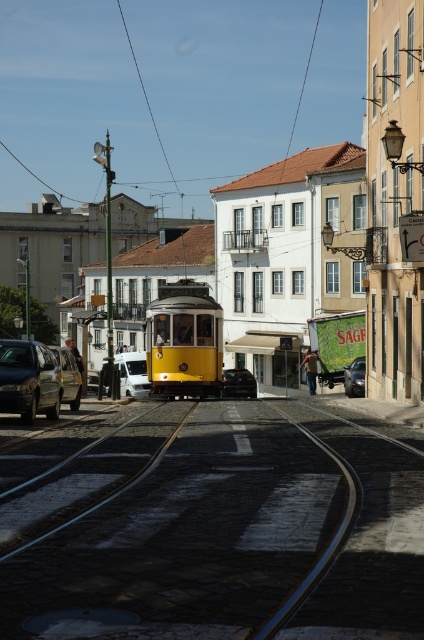
Does black asphalt train track at center have a lesser height compared to shiny black car at center?

Correct, black asphalt train track at center is not as tall as shiny black car at center.

Based on the photo, measure the distance between black asphalt train track at center and camera.

A distance of 5.68 meters exists between black asphalt train track at center and camera.

I want to click on black asphalt train track at center, so click(186, 524).

From the picture: Who is positioned more to the left, black asphalt train track at center or shiny black sedan at center?

black asphalt train track at center

Does black asphalt train track at center appear under shiny black sedan at center?

Incorrect, black asphalt train track at center is not positioned below shiny black sedan at center.

At what (x,y) coordinates should I click in order to perform the action: click on black asphalt train track at center. Please return your answer as a coordinate pair (x, y). Looking at the image, I should click on (186, 524).

Does black asphalt train track at center have a smaller size compared to white matte van at center?

Indeed, black asphalt train track at center has a smaller size compared to white matte van at center.

Measure the distance between point (183, 481) and camera.

Point (183, 481) and camera are 39.39 feet apart from each other.

Which is behind, point (309, 404) or point (131, 392)?

The point (131, 392) is behind.

Find the location of a particular element. Image resolution: width=424 pixels, height=640 pixels. black asphalt train track at center is located at coordinates point(186,524).